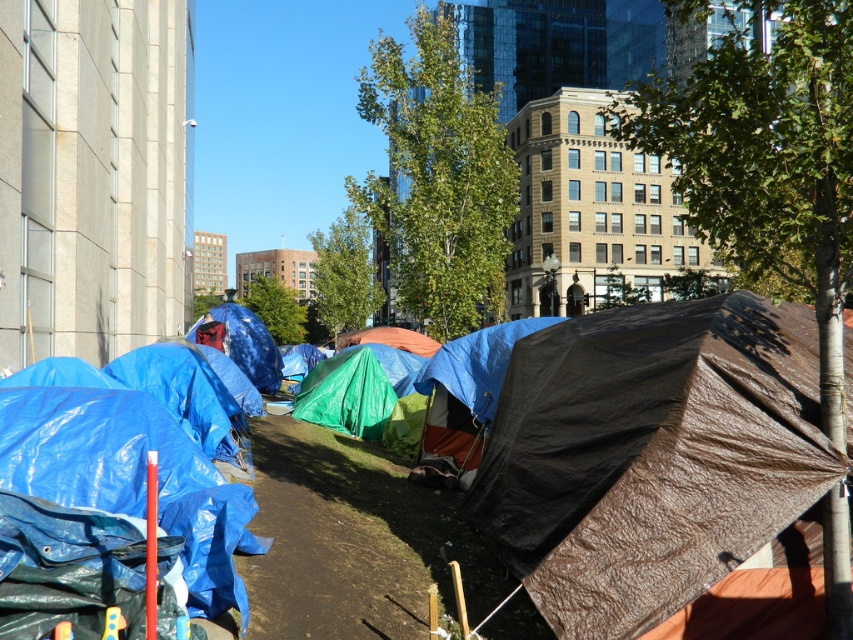
Question: Is brown tarp at center below blue tarp at center?

Choices:
 (A) yes
 (B) no

Answer: (B)

Question: Which of the following is the closest to the observer?

Choices:
 (A) 782,508
 (B) 474,413

Answer: (A)

Question: Is brown tarp at center in front of blue tarp at center?

Choices:
 (A) yes
 (B) no

Answer: (A)

Question: Which object appears closest to the camera in this image?

Choices:
 (A) blue tarp at center
 (B) brown tarp at center

Answer: (B)

Question: Which point is closer to the camera?

Choices:
 (A) (766, 332)
 (B) (444, 433)

Answer: (A)

Question: Is brown tarp at center further to camera compared to blue tarp at center?

Choices:
 (A) no
 (B) yes

Answer: (A)